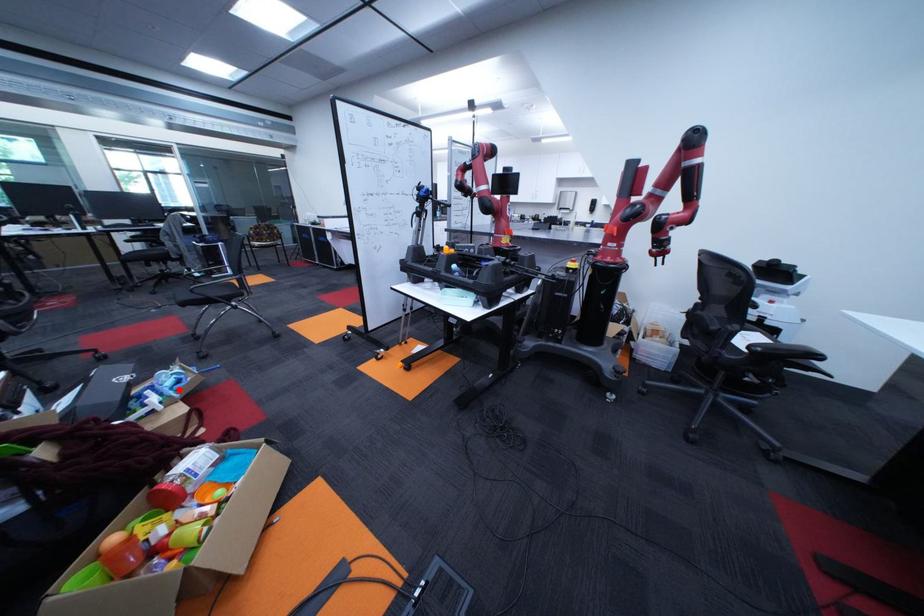
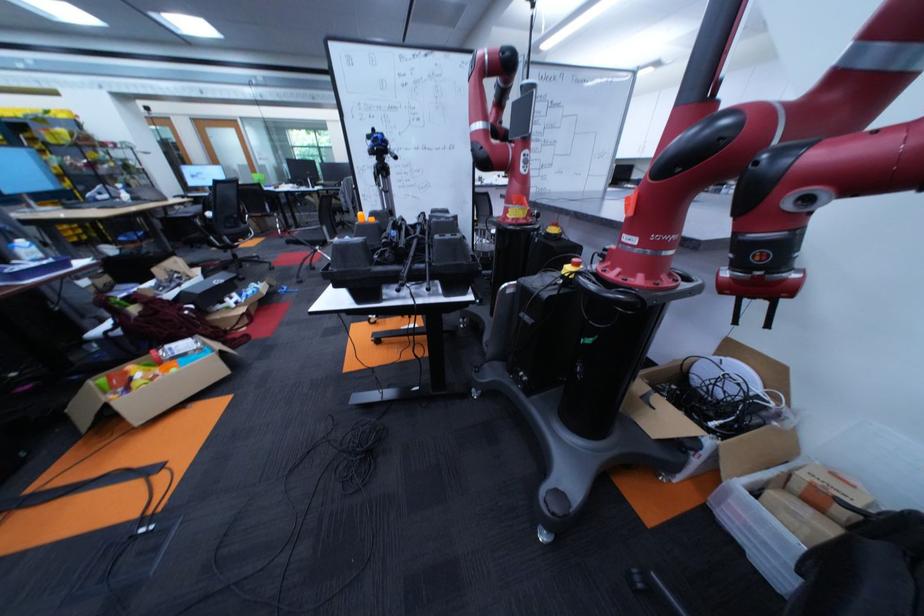
Find the pixel in the second image that matches the highlighted location in the first image.

(258, 296)